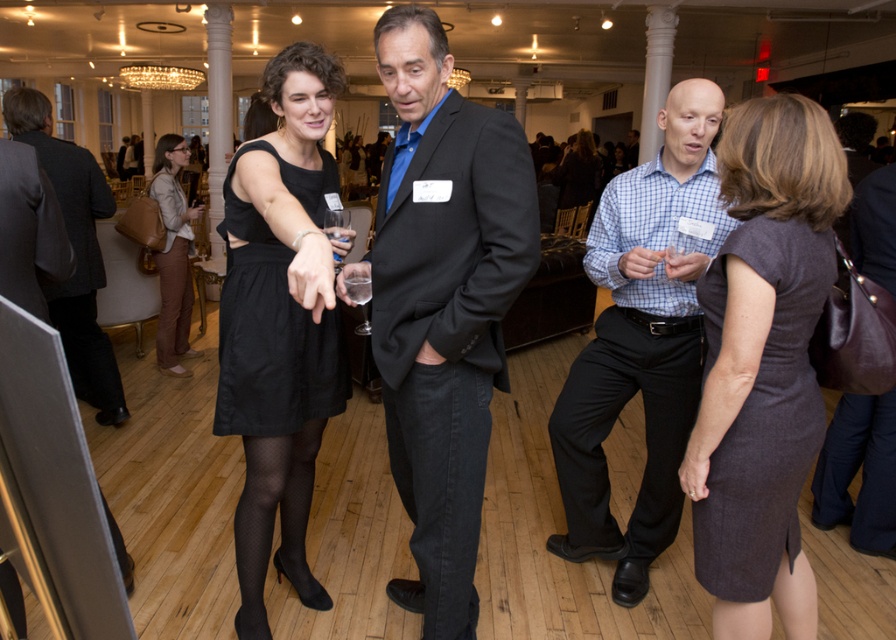
Question: Which of the following is the farthest from the observer?

Choices:
 (A) dark gray wool suit at center
 (B) blue checkered shirt at center

Answer: (A)

Question: Can you confirm if blue checkered shirt at center is positioned above dark gray wool suit at center?

Choices:
 (A) no
 (B) yes

Answer: (A)

Question: Observing the image, what is the correct spatial positioning of black satin dress at center in reference to matte brown pants at lower left?

Choices:
 (A) below
 (B) above

Answer: (A)

Question: Which object appears closest to the camera in this image?

Choices:
 (A) matte brown pants at lower left
 (B) black matte dress at center
 (C) black satin dress at center

Answer: (B)

Question: Among these objects, which one is farthest from the camera?

Choices:
 (A) matte black suit at center
 (B) black satin dress at center
 (C) matte brown pants at lower left

Answer: (C)

Question: Where is dark gray fabric dress at center-right located in relation to matte brown pants at lower left in the image?

Choices:
 (A) above
 (B) below

Answer: (B)